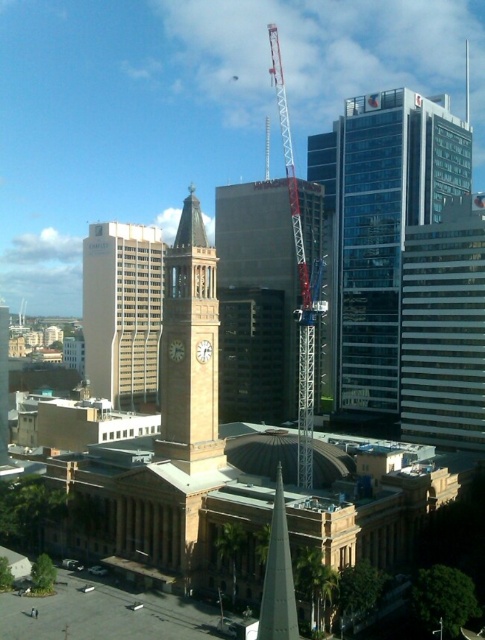
Question: Which object is farther from the camera taking this photo?

Choices:
 (A) glassy blue skyscraper at upper right
 (B) metallic red crane at center

Answer: (A)

Question: Is glassy blue skyscraper at upper right behind metallic red crane at center?

Choices:
 (A) yes
 (B) no

Answer: (A)

Question: Is clear glass skyscraper at right to the right of metallic red crane at center from the viewer's perspective?

Choices:
 (A) no
 (B) yes

Answer: (B)

Question: Does glassy blue skyscraper at upper right appear under beige stone clock tower at center?

Choices:
 (A) yes
 (B) no

Answer: (B)

Question: Which point appears farthest from the camera in this image?

Choices:
 (A) (192, 288)
 (B) (389, 179)

Answer: (B)

Question: Which point is closer to the camera taking this photo?

Choices:
 (A) (143, 252)
 (B) (297, 253)

Answer: (B)